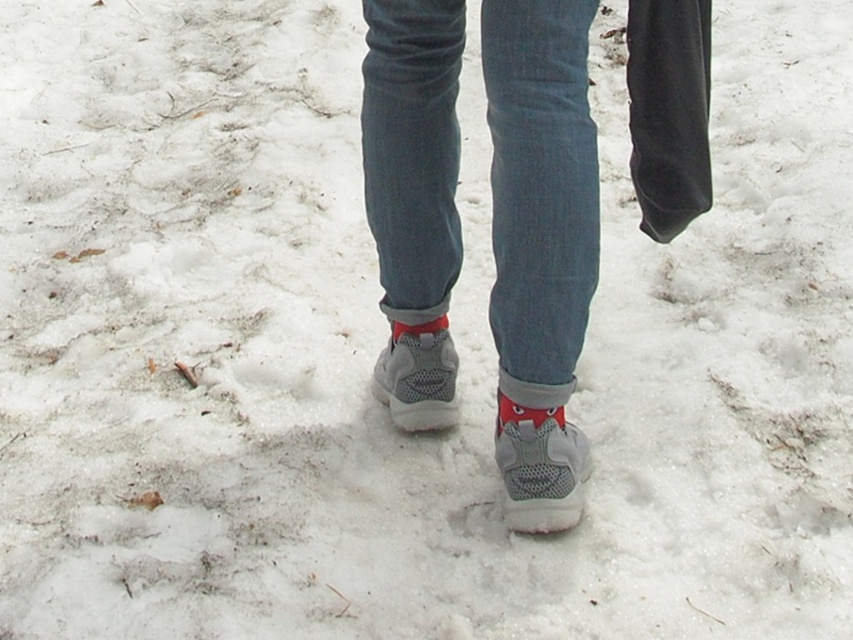
You are a photographer setting up a shot of the scene described. You want to ensure both the denim at center and the red suede sock at lower center are in focus. Given that your camera can only focus on objects within a 15 inch range, will both objects be in focus?

The denim at center and the red suede sock at lower center are 16.52 inches apart from each other. Since the camera can only focus within a 15 inch range, the distance between them exceeds this limit, so both objects cannot be in focus simultaneously.

You are trying to decide whether to wear the denim at center or the red suede sock at lower center as a makeshift ground cover. Which one would provide a larger surface area to protect your belongings from the snow?

The denim at center is larger in size than the red suede sock at lower center, so it would provide a larger surface area to protect your belongings from the snow.

What are the coordinates of the denim at center in the image?

The denim at center is located at coordinates point (540, 180).